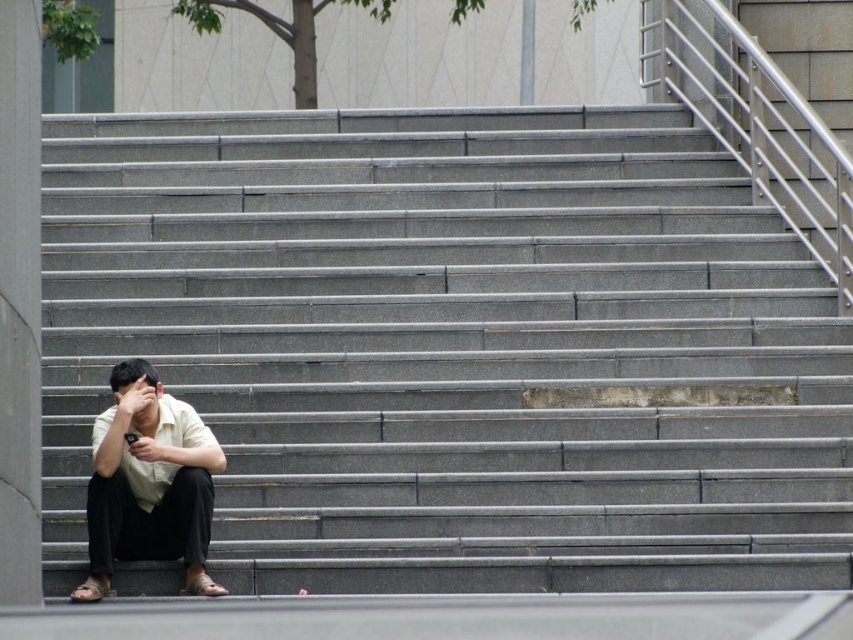
In the scene shown: You are standing at the center of the image and want to sit down on the gray concrete stairs at lower left. In which direction should you move to reach them?

You should move towards the lower left direction to reach the gray concrete stairs at lower left.

You are standing at the bottom of the staircase and want to walk towards the point that is closer to you. Which point should you head towards, point (x=663, y=200) or point (x=152, y=458)?

You should head towards point (x=152, y=458) because it is closer to you than point (x=663, y=200), which is further away.